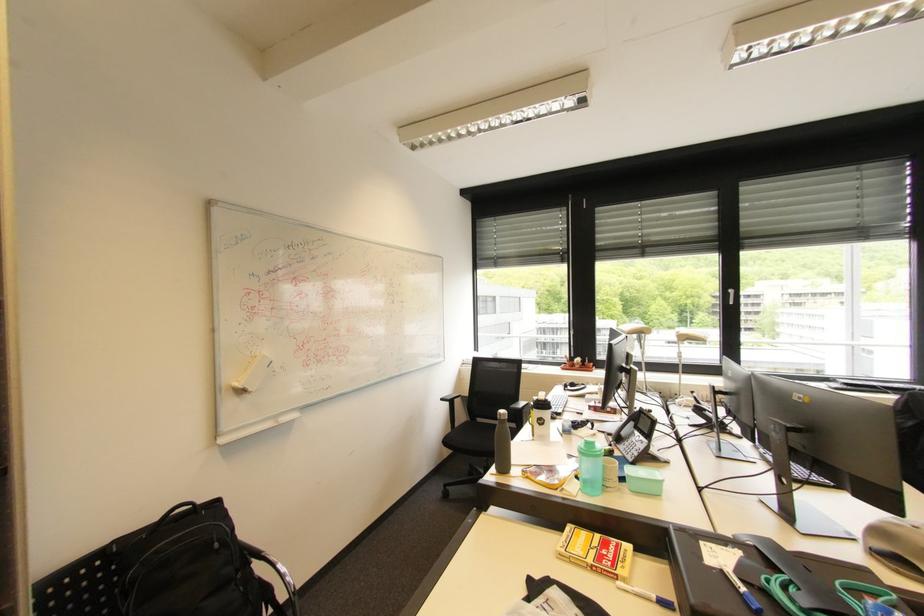
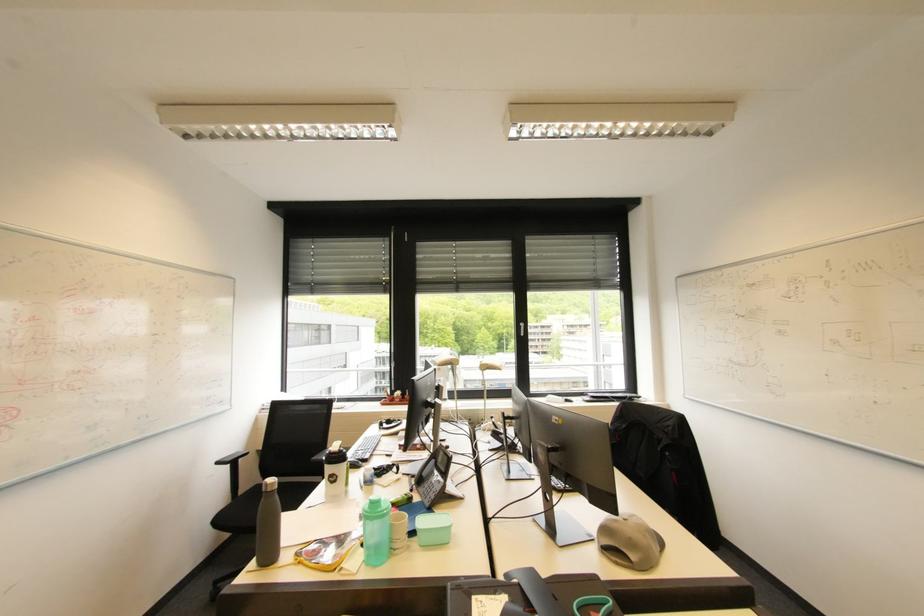
Question: The images are taken continuously from a first-person perspective. In which direction is your viewpoint rotating?

Choices:
 (A) Left
 (B) Right
 (C) Up
 (D) Down

Answer: (B)